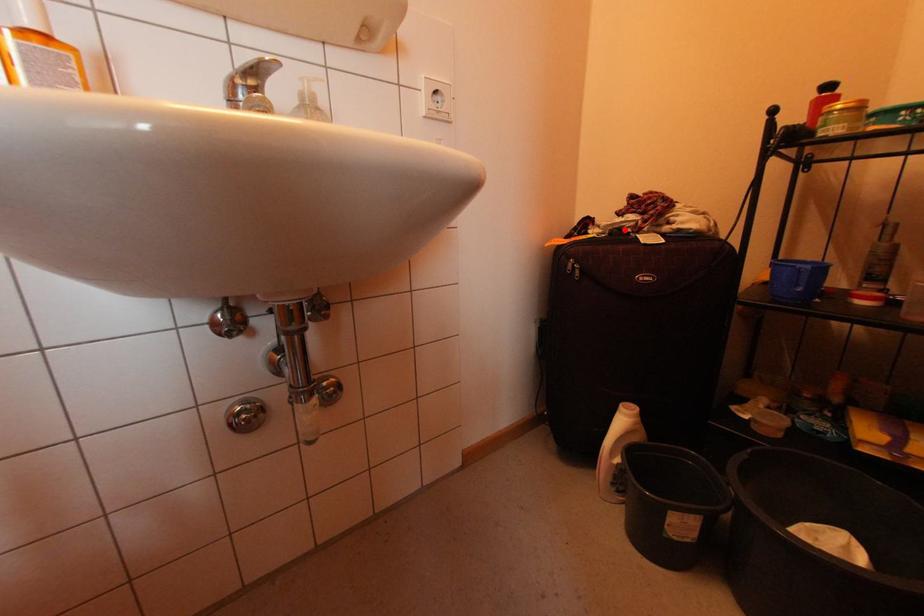
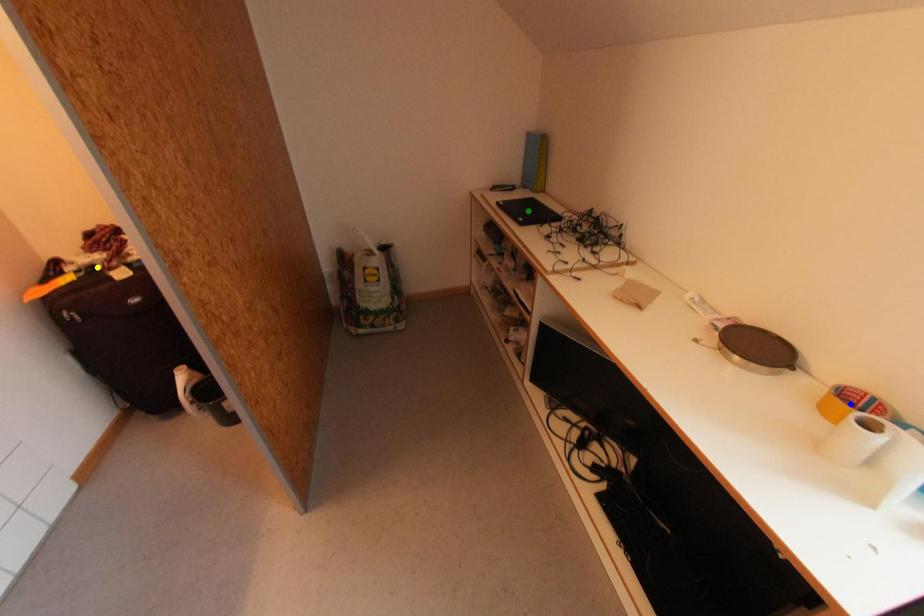
Question: I am providing you with two images of the same scene from different viewpoints. A red point is marked on the first image. You are given multiple points on the second image. Which point in image 2 represents the same 3d spot as the red point in image 1?

Choices:
 (A) green point
 (B) yellow point
 (C) blue point

Answer: (B)